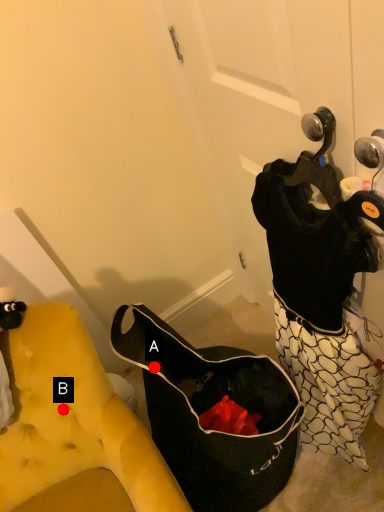
Question: Two points are circled on the image, labeled by A and B beside each circle. Which point is closer to the camera?

Choices:
 (A) A is closer
 (B) B is closer

Answer: (B)